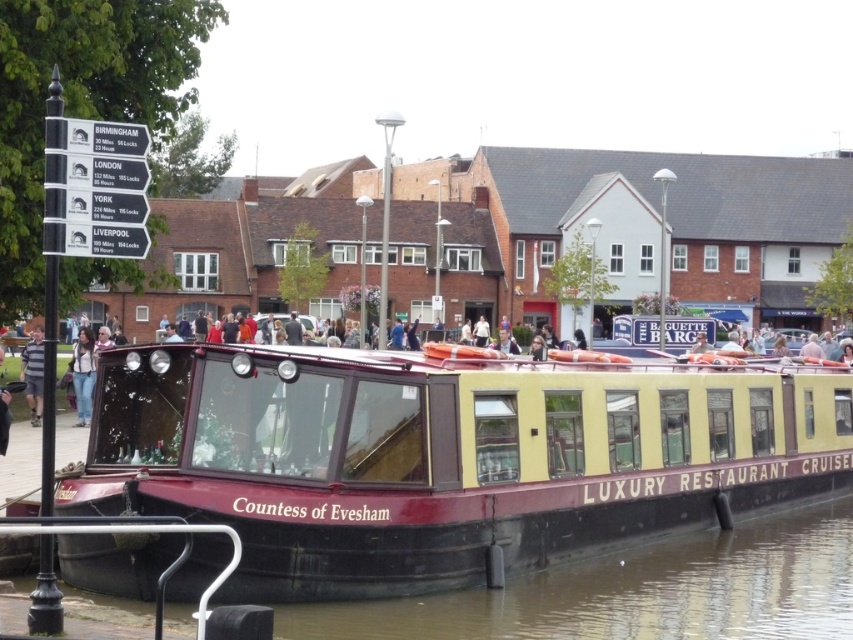
Question: In this image, where is maroon polished wood boat at center located relative to striped cotton shirt at left?

Choices:
 (A) above
 (B) below

Answer: (B)

Question: Which object appears closest to the camera in this image?

Choices:
 (A) black rubber boat at lower center
 (B) denim jeans at lower left
 (C) striped cotton shirt at left
 (D) maroon polished wood boat at center

Answer: (D)

Question: Does black rubber boat at lower center appear on the right side of striped cotton shirt at left?

Choices:
 (A) no
 (B) yes

Answer: (B)

Question: Which of the following is the closest to the observer?

Choices:
 (A) striped cotton shirt at left
 (B) black rubber boat at lower center
 (C) denim jeans at lower left
 (D) maroon polished wood boat at center

Answer: (D)

Question: Does maroon polished wood boat at center appear on the right side of striped cotton shirt at left?

Choices:
 (A) yes
 (B) no

Answer: (A)

Question: Considering the real-world distances, which object is closest to the maroon polished wood boat at center?

Choices:
 (A) striped cotton shirt at left
 (B) denim jeans at lower left
 (C) black rubber boat at lower center

Answer: (C)